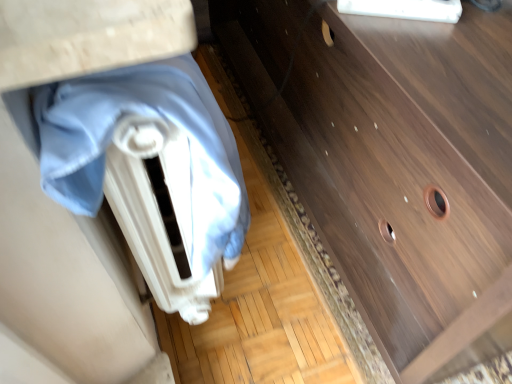
Question: Does blue fabric at left appear on the left side of wooden vanity at center?

Choices:
 (A) yes
 (B) no

Answer: (A)

Question: From a real-world perspective, is blue fabric at left on wooden vanity at center?

Choices:
 (A) no
 (B) yes

Answer: (B)

Question: Is there a large distance between blue fabric at left and wooden vanity at center?

Choices:
 (A) yes
 (B) no

Answer: (B)

Question: Is blue fabric at left behind wooden vanity at center?

Choices:
 (A) no
 (B) yes

Answer: (B)

Question: Is blue fabric at left with wooden vanity at center?

Choices:
 (A) yes
 (B) no

Answer: (B)

Question: Is wooden vanity at center at the back of blue fabric at left?

Choices:
 (A) yes
 (B) no

Answer: (A)

Question: Would you say dark wood chest of drawers at center is part of wooden vanity at center's contents?

Choices:
 (A) no
 (B) yes

Answer: (A)

Question: Is wooden vanity at center completely or partially outside of dark wood chest of drawers at center?

Choices:
 (A) no
 (B) yes

Answer: (B)

Question: Are wooden vanity at center and dark wood chest of drawers at center located far from each other?

Choices:
 (A) yes
 (B) no

Answer: (B)

Question: Is the position of wooden vanity at center more distant than that of dark wood chest of drawers at center?

Choices:
 (A) no
 (B) yes

Answer: (A)

Question: Is wooden vanity at center turned away from dark wood chest of drawers at center?

Choices:
 (A) no
 (B) yes

Answer: (B)

Question: Is wooden vanity at center taller than dark wood chest of drawers at center?

Choices:
 (A) no
 (B) yes

Answer: (B)

Question: Is dark wood chest of drawers at center located outside blue fabric at left?

Choices:
 (A) no
 (B) yes

Answer: (B)